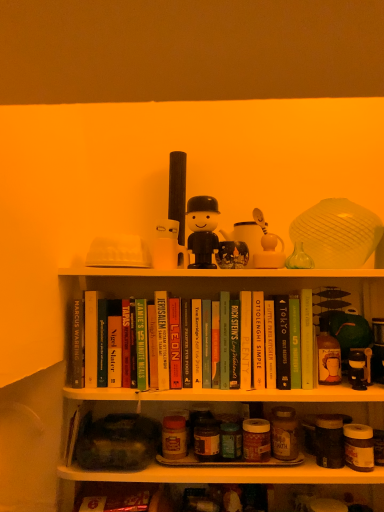
Locate an element on the screen. The height and width of the screenshot is (512, 384). free space in front of hardcover book at center, the ninth paperback book when ordered from right to left is located at coordinates (184, 388).